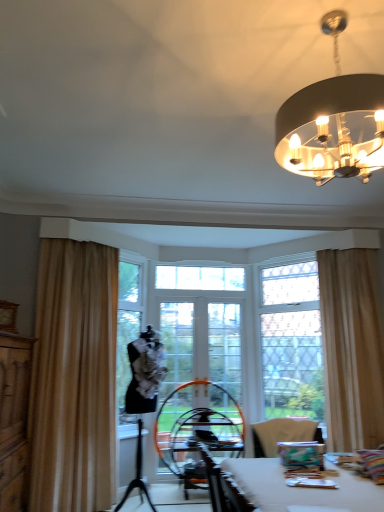
Question: Is wooden dresser at left inside or outside of matte black chandelier at upper right?

Choices:
 (A) inside
 (B) outside

Answer: (B)

Question: In the image, is wooden dresser at left positioned in front of or behind matte black chandelier at upper right?

Choices:
 (A) front
 (B) behind

Answer: (B)

Question: Which is farther from the white glossy table at lower right?

Choices:
 (A) white fabric chair at center
 (B) wooden dresser at left
 (C) beige fabric curtain at right, the first curtain when ordered from right to left
 (D) black leather swivel chair at center
 (E) beige fabric curtain at left, the first curtain from the left

Answer: (D)

Question: Estimate the real-world distances between objects in this image. Which object is farther from the clear glass window at center?

Choices:
 (A) beige fabric curtain at left, which is the 2th curtain from right to left
 (B) beige fabric curtain at right, arranged as the 2th curtain when viewed from the left
 (C) matte black chandelier at upper right
 (D) wooden dresser at left
 (E) black leather swivel chair at center

Answer: (D)